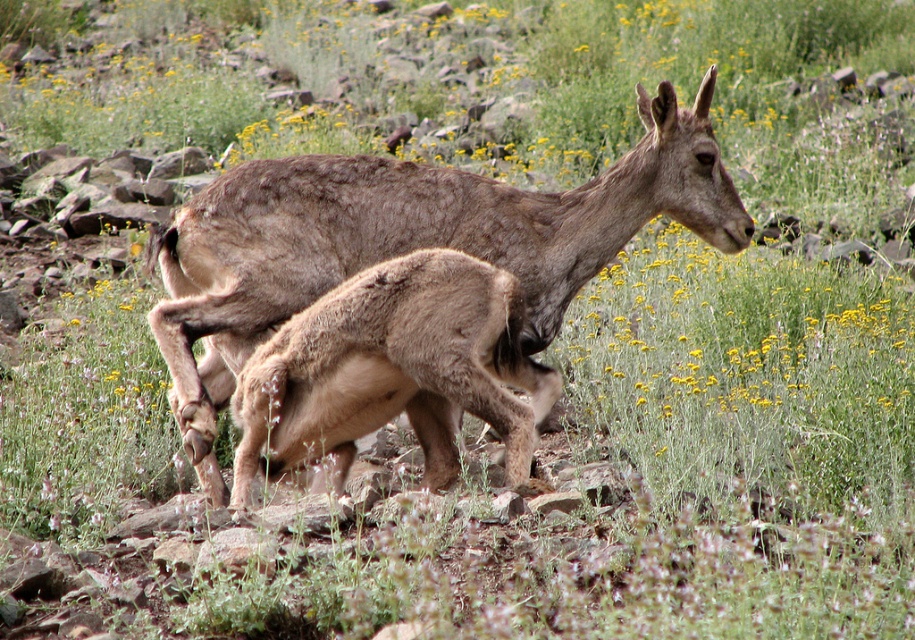
Is brown woolen deer at center smaller than brown woolen baby deer at center?

Incorrect, brown woolen deer at center is not smaller in size than brown woolen baby deer at center.

Consider the image. Between brown woolen deer at center and brown woolen baby deer at center, which one is positioned lower?

brown woolen baby deer at center is lower down.

Does point (379, 257) lie behind point (321, 417)?

Yes, point (379, 257) is farther from viewer.

At what (x,y) coordinates should I click in order to perform the action: click on brown woolen deer at center. Please return your answer as a coordinate pair (x, y). Looking at the image, I should click on click(408, 241).